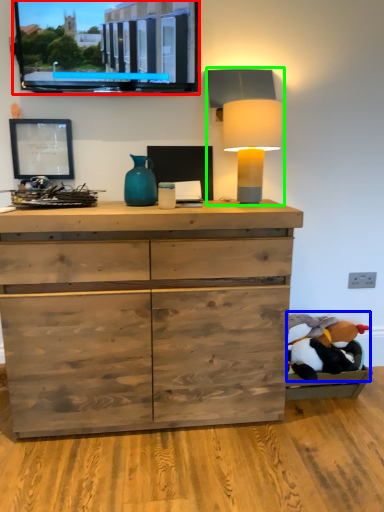
Question: Estimate the real-world distances between objects in this image. Which object is closer to computer monitor (highlighted by a red box), animal (highlighted by a blue box) or table lamp (highlighted by a green box)?

Choices:
 (A) animal
 (B) table lamp

Answer: (B)